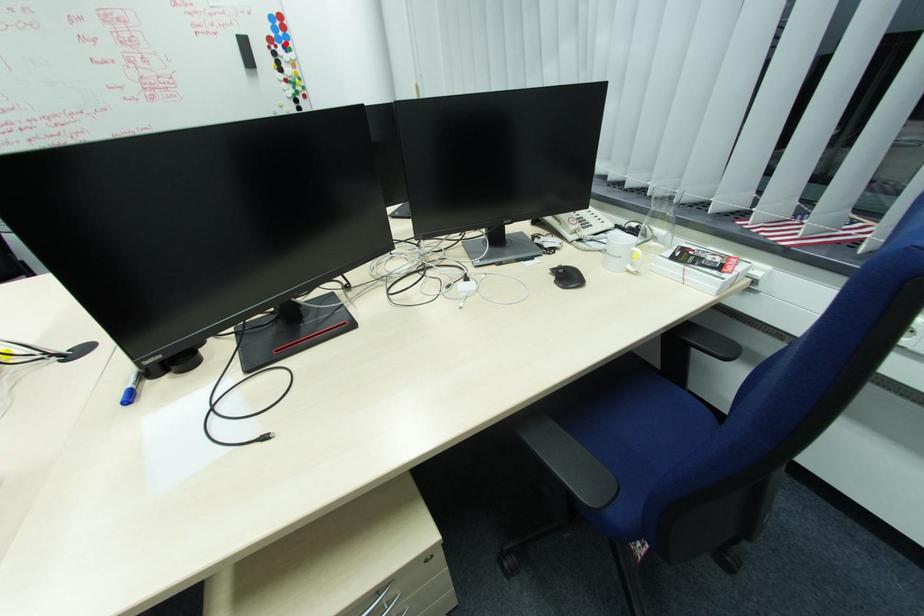
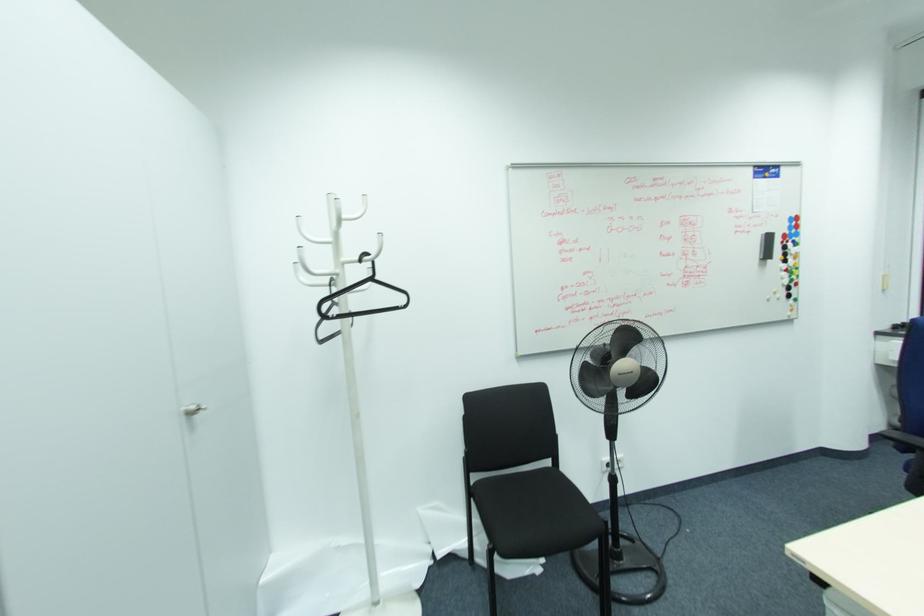
Locate, in the second image, the point that corresponds to the highlighted location in the first image.

(796, 238)